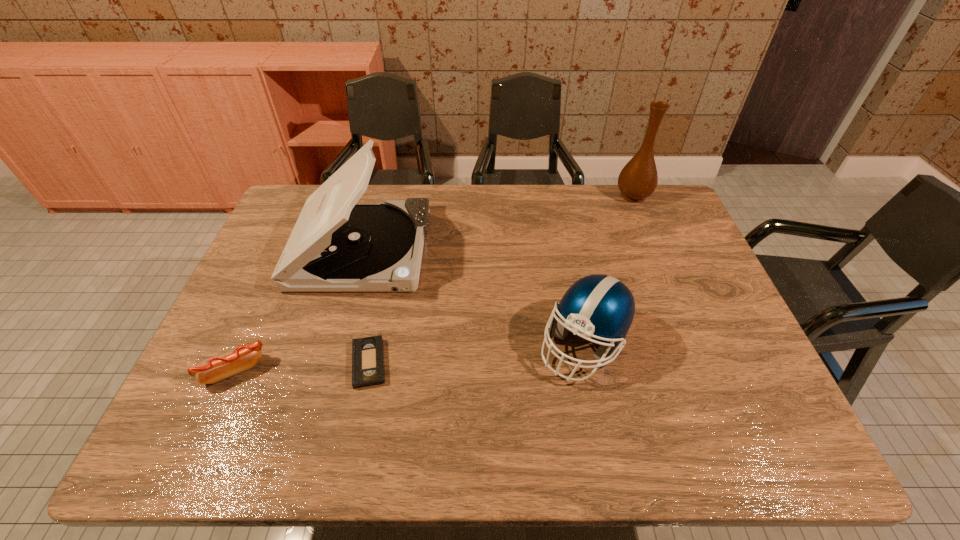
Locate an element on the screen. free space located 0.070m on the right of the sausage is located at coordinates (294, 371).

I want to click on vacant space located on the back of the videotape, so click(386, 277).

You are a GUI agent. You are given a task and a screenshot of the screen. Output one action in this format:
    pyautogui.click(x=<x>, y=<y>)
    Task: Click on the vase positioned at the far edge
    
    Given the screenshot: What is the action you would take?
    pyautogui.click(x=638, y=179)

In order to click on CD player that is at the far edge in this screenshot , I will do `click(336, 245)`.

I want to click on CD player that is at the left edge, so (336, 245).

The width and height of the screenshot is (960, 540). I want to click on sausage that is positioned at the left edge, so click(211, 370).

At what (x,y) coordinates should I click in order to perform the action: click on object that is at the right edge. Please return your answer as a coordinate pair (x, y). The width and height of the screenshot is (960, 540). Looking at the image, I should click on (638, 179).

This screenshot has width=960, height=540. In order to click on object located at the far left corner in this screenshot , I will do `click(336, 245)`.

You are a GUI agent. You are given a task and a screenshot of the screen. Output one action in this format:
    pyautogui.click(x=<x>, y=<y>)
    Task: Click on the object at the far right corner
    The width and height of the screenshot is (960, 540).
    Given the screenshot: What is the action you would take?
    pyautogui.click(x=638, y=179)

The height and width of the screenshot is (540, 960). I want to click on vacant position at the far edge of the desktop, so click(x=492, y=187).